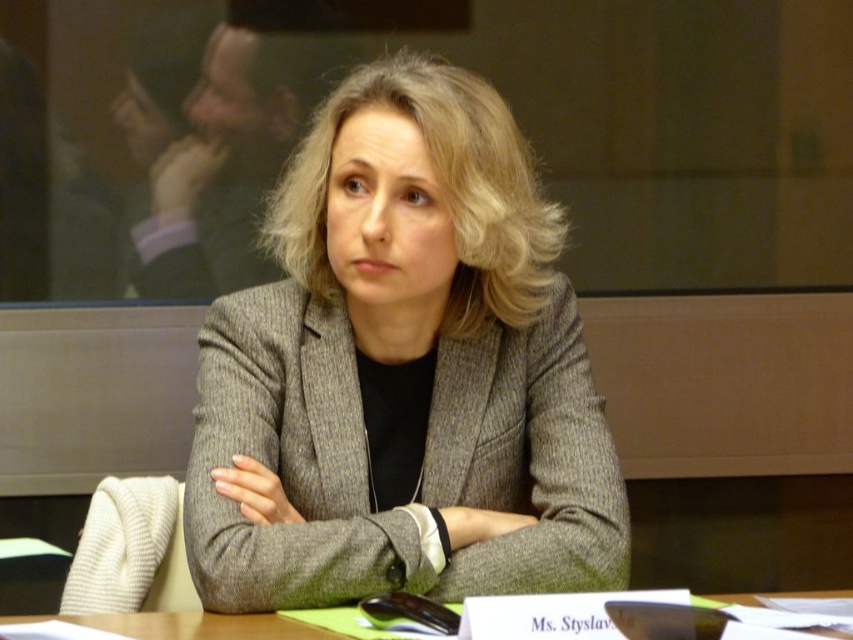
Question: Is gray textured blazer at center closer to the viewer compared to green felt placemat at center?

Choices:
 (A) no
 (B) yes

Answer: (A)

Question: Does gray textured blazer at center appear over green felt placemat at center?

Choices:
 (A) no
 (B) yes

Answer: (B)

Question: Which point is closer to the camera?

Choices:
 (A) (254, 557)
 (B) (282, 621)

Answer: (B)

Question: Is the position of gray textured blazer at center more distant than that of green felt placemat at center?

Choices:
 (A) no
 (B) yes

Answer: (B)

Question: Which point is farther from the camera taking this photo?

Choices:
 (A) (361, 593)
 (B) (120, 627)

Answer: (A)